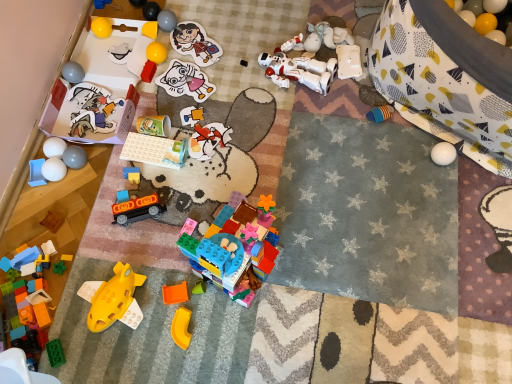
Locate an element on the screen. Image resolution: width=512 pixels, height=384 pixels. vacant area that is in front of white matte balls at left, placed as the 22th toy when sorted from right to left is located at coordinates (x=53, y=220).